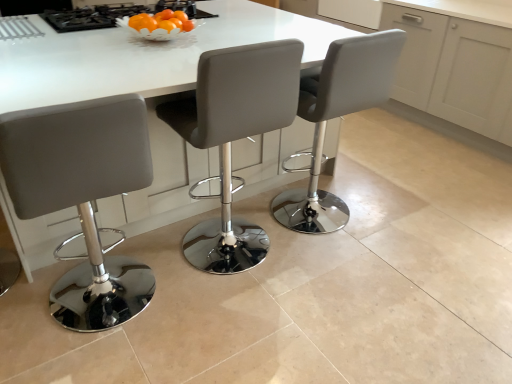
Question: Is matte gray stool at center, the 2th chair when ordered from right to left, at the right side of black glass gas stove at upper center?

Choices:
 (A) no
 (B) yes

Answer: (B)

Question: Does matte gray stool at center, the 2th chair when ordered from right to left, have a smaller size compared to black glass gas stove at upper center?

Choices:
 (A) yes
 (B) no

Answer: (B)

Question: Is matte gray stool at center, the 2th chair when ordered from left to right, oriented away from black glass gas stove at upper center?

Choices:
 (A) yes
 (B) no

Answer: (B)

Question: Is matte gray stool at center, the 2th chair when ordered from right to left, closer to camera compared to black glass gas stove at upper center?

Choices:
 (A) no
 (B) yes

Answer: (B)

Question: Considering the relative sizes of matte gray stool at center, the 2th chair when ordered from right to left, and black glass gas stove at upper center in the image provided, is matte gray stool at center, the 2th chair when ordered from right to left, taller than black glass gas stove at upper center?

Choices:
 (A) no
 (B) yes

Answer: (B)

Question: Relative to black glass gas stove at upper center, is white glossy table at center in front or behind?

Choices:
 (A) behind
 (B) front

Answer: (B)

Question: In terms of height, does white glossy table at center look taller or shorter compared to black glass gas stove at upper center?

Choices:
 (A) tall
 (B) short

Answer: (A)

Question: From the image's perspective, is white glossy table at center above or below black glass gas stove at upper center?

Choices:
 (A) below
 (B) above

Answer: (A)

Question: Considering the positions of white glossy table at center and black glass gas stove at upper center in the image, is white glossy table at center bigger or smaller than black glass gas stove at upper center?

Choices:
 (A) small
 (B) big

Answer: (B)

Question: From a real-world perspective, relative to black glass gas stove at upper center, is matte gray stool at center, marked as the 3th chair in a right-to-left arrangement, vertically above or below?

Choices:
 (A) below
 (B) above

Answer: (A)

Question: In the image, is matte gray stool at center, acting as the first chair starting from the left, positioned in front of or behind black glass gas stove at upper center?

Choices:
 (A) behind
 (B) front

Answer: (B)

Question: In terms of width, does matte gray stool at center, marked as the 3th chair in a right-to-left arrangement, look wider or thinner when compared to black glass gas stove at upper center?

Choices:
 (A) thin
 (B) wide

Answer: (A)

Question: From their relative heights in the image, would you say matte gray stool at center, acting as the first chair starting from the left, is taller or shorter than black glass gas stove at upper center?

Choices:
 (A) short
 (B) tall

Answer: (B)

Question: Is matte gray stool at center, the 2th chair when ordered from right to left, wider or thinner than white glossy table at center?

Choices:
 (A) wide
 (B) thin

Answer: (B)

Question: From a real-world perspective, relative to white glossy table at center, is matte gray stool at center, the 2th chair when ordered from right to left, vertically above or below?

Choices:
 (A) above
 (B) below

Answer: (A)